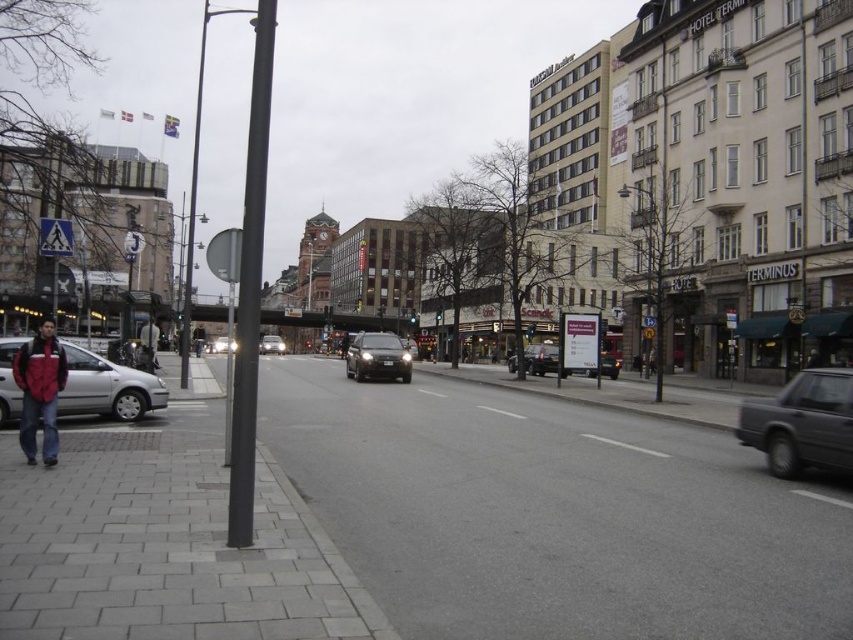
Question: Is gray concrete pavement at lower left to the left of dark gray metallic car at right from the viewer's perspective?

Choices:
 (A) yes
 (B) no

Answer: (A)

Question: Which is farther from the shiny silver sedan at center?

Choices:
 (A) metallic pole at left
 (B) silver metallic sedan at center
 (C) dark gray metallic car at right
 (D) gray concrete pavement at lower left

Answer: (A)

Question: Estimate the real-world distances between objects in this image. Which object is closer to the silver metallic sedan at center?

Choices:
 (A) silver metallic car at lower left
 (B) shiny silver sedan at center

Answer: (B)

Question: Does silver metallic sedan at center appear under shiny silver sedan at center?

Choices:
 (A) no
 (B) yes

Answer: (B)

Question: Among these objects, which one is nearest to the camera?

Choices:
 (A) metallic pole at left
 (B) gray concrete pavement at lower left

Answer: (B)

Question: Is dark gray metallic car at right behind shiny silver sedan at center?

Choices:
 (A) yes
 (B) no

Answer: (A)